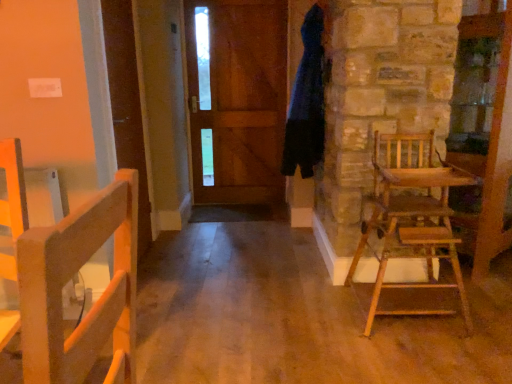
Identify the location of vacant position to the left of wooden high chair at right. This screenshot has width=512, height=384. (317, 321).